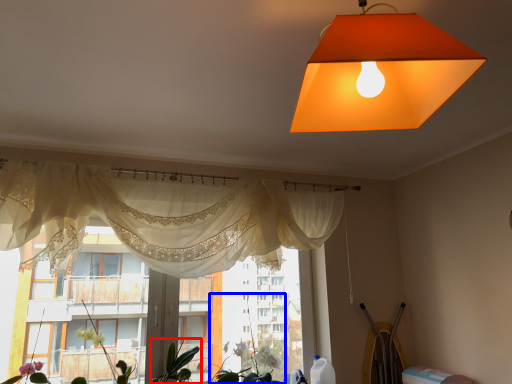
Question: Which of the following is the farthest to the observer, plant (highlighted by a red box) or plant (highlighted by a blue box)?

Choices:
 (A) plant
 (B) plant

Answer: (B)